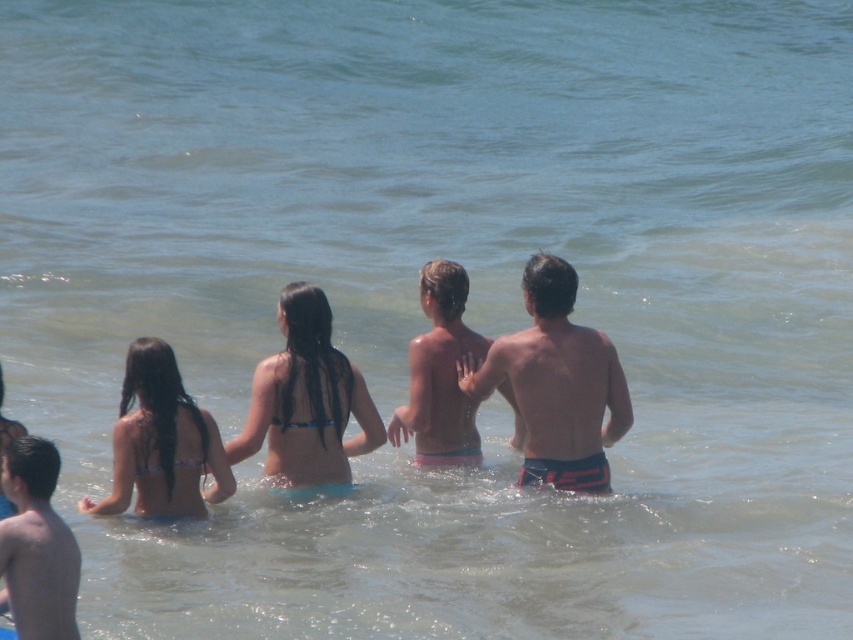
In the beach scene, there are two people visible in the water. The pink fabric shorts at center and the smooth skin boy at lower left. Which one is positioned to the right of the other?

The pink fabric shorts at center is to the right of smooth skin boy at lower left.

In the scene shown: You are a photographer trying to capture a group photo of the blue bikini top at center and the smooth skin boy at lower left. Based on their positions, which one should you focus on first to ensure they are both in focus?

The blue bikini top at center is taller than the smooth skin boy at lower left, so you should focus on the blue bikini top at center first to ensure both are in focus since focusing on the taller subject can help maintain focus on the shorter one.